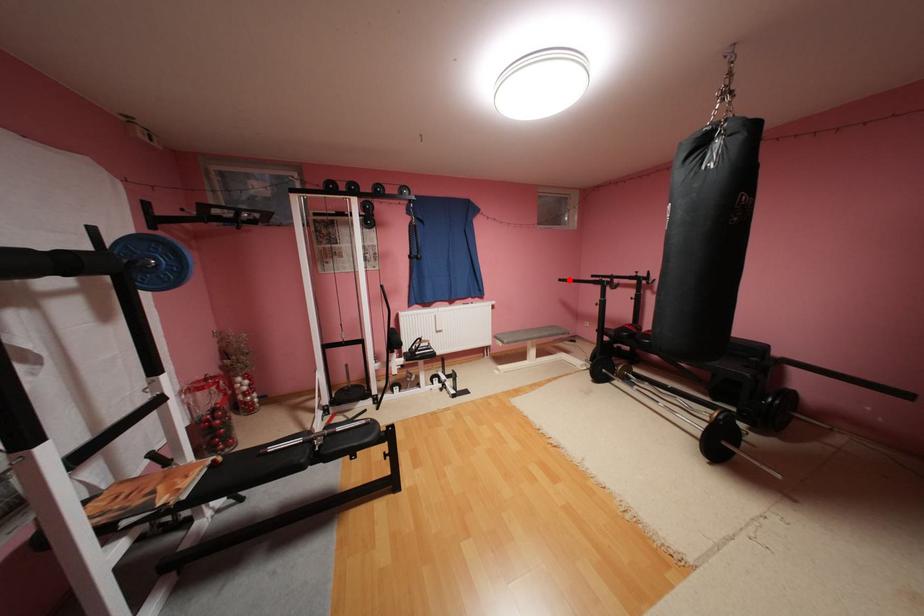
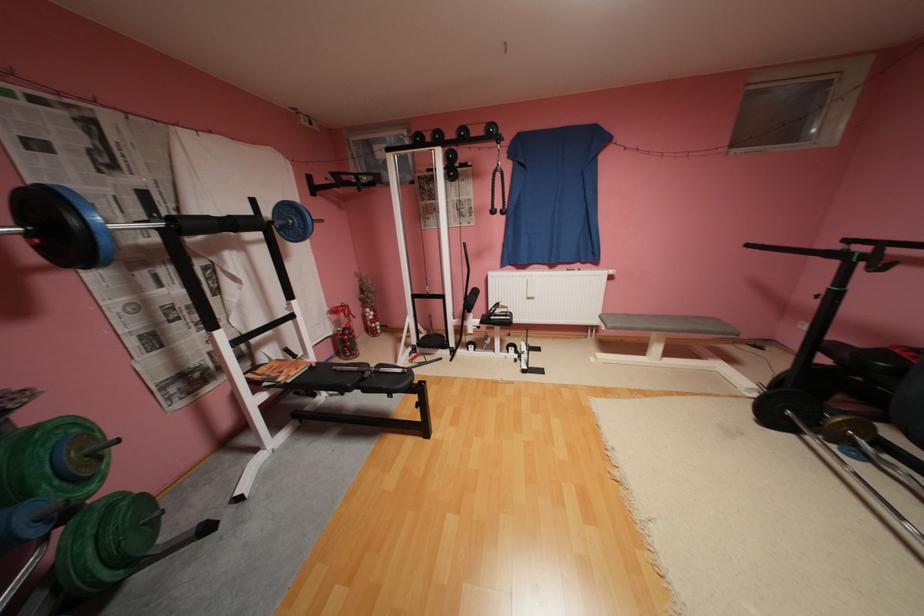
Locate, in the second image, the point that corresponds to the highlighted location in the first image.

(757, 246)